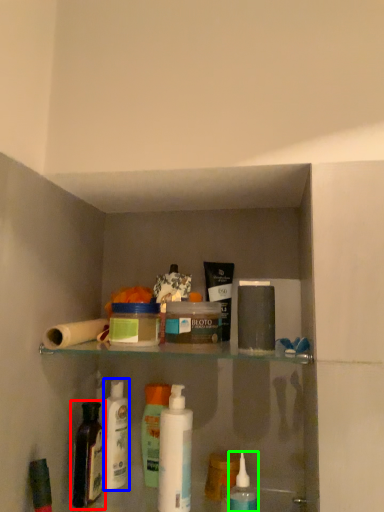
Question: Considering the real-world distances, which object is closest to bottle (highlighted by a red box)? cleaning product (highlighted by a blue box) or mouthwash (highlighted by a green box).

Choices:
 (A) cleaning product
 (B) mouthwash

Answer: (A)